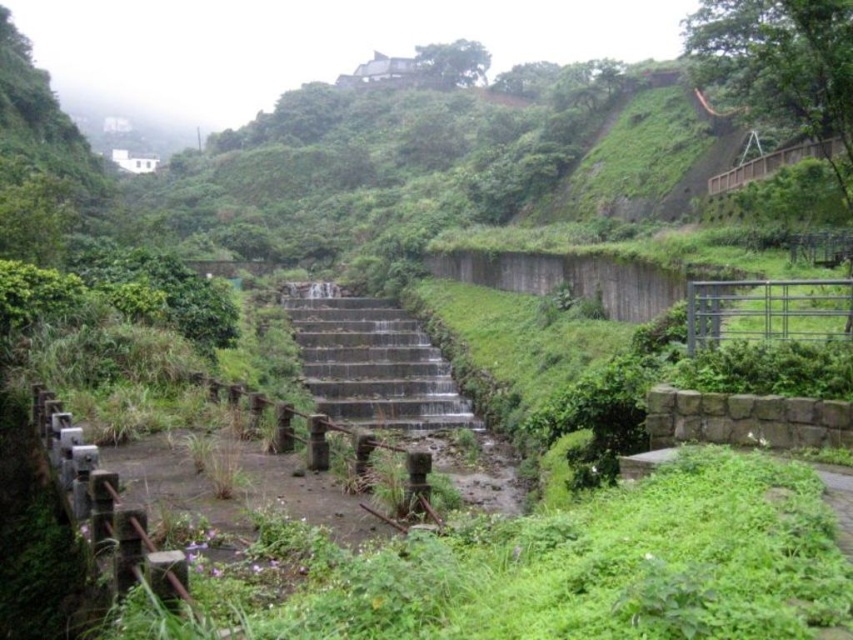
You are a hiker carrying a 100 feet long rope. You want to secure the gray concrete stairs at center and the metallic silver rail at right with the rope. Is the rope long enough to stretch between them without any slack?

The gray concrete stairs at center and metallic silver rail at right are 91.42 feet apart from each other. Since the rope is 100 feet long, it is long enough to stretch between them without any slack.

You are standing at the top of the concrete steps leading down to the stream. You need to reach the metallic silver rail at right which is 48.02 feet away. If you walk straight down the steps, will you be able to reach it without deviating from your path?

The metallic silver rail at right is 48.02 feet away from the viewer. Since the rail is positioned to the right and you are walking straight down the steps, you will not reach it without deviating from your path as the distance is measured directly to the rail which is off the central path.